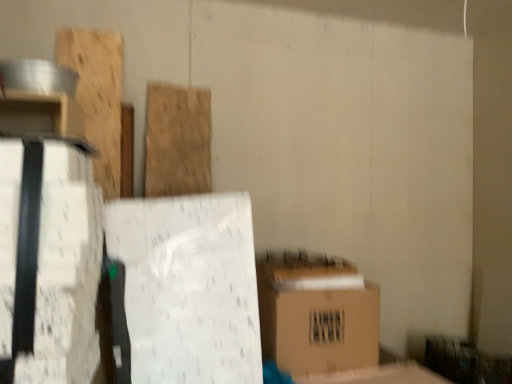
Question: Does brown cardboard box at lower right lie behind white matte cardboard box at left?

Choices:
 (A) no
 (B) yes

Answer: (B)

Question: Would you say brown cardboard box at lower right is outside white matte cardboard box at left?

Choices:
 (A) no
 (B) yes

Answer: (B)

Question: Could white matte cardboard box at left be considered to be inside brown cardboard box at lower right?

Choices:
 (A) yes
 (B) no

Answer: (B)

Question: Are brown cardboard box at lower right and white matte cardboard box at left far apart?

Choices:
 (A) yes
 (B) no

Answer: (A)

Question: From the image's perspective, is brown cardboard box at lower right on top of white matte cardboard box at left?

Choices:
 (A) yes
 (B) no

Answer: (B)

Question: Considering the positions of white matte cardboard box at left and natural wood plank at center, the 1th wood viewed from the right, in the image, is white matte cardboard box at left wider or thinner than natural wood plank at center, the 1th wood viewed from the right,?

Choices:
 (A) wide
 (B) thin

Answer: (A)

Question: From the image's perspective, is white matte cardboard box at left located above or below natural wood plank at center, marked as the second wood in a left-to-right arrangement?

Choices:
 (A) above
 (B) below

Answer: (B)

Question: Is point (68, 160) positioned closer to the camera than point (182, 157)?

Choices:
 (A) closer
 (B) farther

Answer: (A)

Question: Is white matte cardboard box at left situated inside natural wood plank at center, the 1th wood viewed from the right, or outside?

Choices:
 (A) inside
 (B) outside

Answer: (B)

Question: Looking at the image, does brown cardboard box at lower right seem bigger or smaller compared to white matte cardboard box at left?

Choices:
 (A) small
 (B) big

Answer: (A)

Question: From the image's perspective, is brown cardboard box at lower right above or below white matte cardboard box at left?

Choices:
 (A) above
 (B) below

Answer: (B)

Question: Does point (272, 331) appear closer or farther from the camera than point (13, 299)?

Choices:
 (A) closer
 (B) farther

Answer: (B)

Question: Considering the positions of brown cardboard box at lower right and white matte cardboard box at left in the image, is brown cardboard box at lower right taller or shorter than white matte cardboard box at left?

Choices:
 (A) tall
 (B) short

Answer: (B)

Question: In the image, is white matte cardboard box at left positioned in front of or behind wooden plank at upper left, the first wood from the left?

Choices:
 (A) front
 (B) behind

Answer: (A)

Question: Looking at their shapes, would you say white matte cardboard box at left is wider or thinner than wooden plank at upper left, marked as the second wood in a right-to-left arrangement?

Choices:
 (A) thin
 (B) wide

Answer: (B)